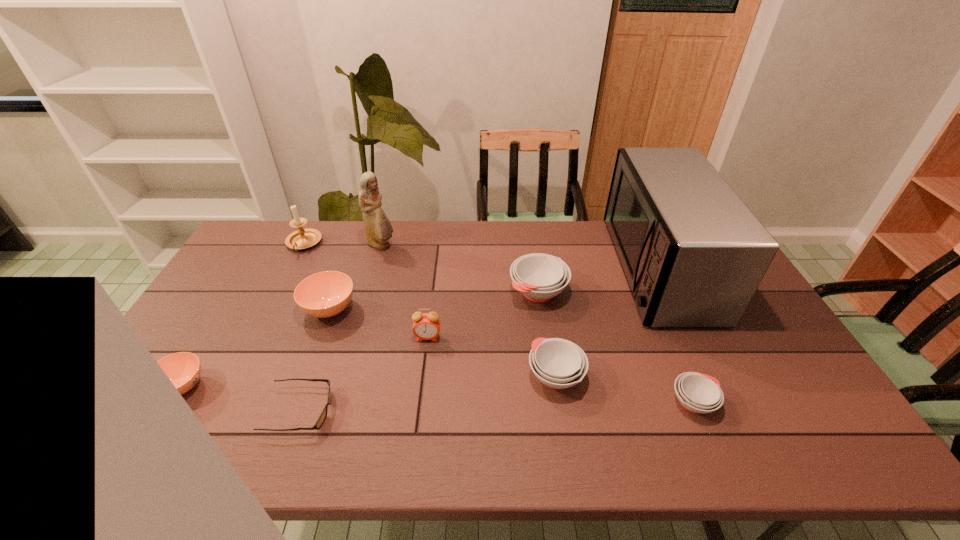
Where is `unoccupied position between the figurine and the biggest white soup bowl`? This screenshot has width=960, height=540. unoccupied position between the figurine and the biggest white soup bowl is located at coordinates (460, 268).

Locate an element on the screen. Image resolution: width=960 pixels, height=540 pixels. empty location between the farther peach soup bowl and the figurine is located at coordinates (355, 277).

You are a GUI agent. You are given a task and a screenshot of the screen. Output one action in this format:
    pyautogui.click(x=<x>, y=<y>)
    Task: Click on the free area in between the second biggest white soup bowl and the farther peach soup bowl
    
    Given the screenshot: What is the action you would take?
    pyautogui.click(x=443, y=342)

At what (x,y) coordinates should I click in order to perform the action: click on free area in between the microwave_oven and the second biggest white soup bowl. Please return your answer as a coordinate pair (x, y). Image resolution: width=960 pixels, height=540 pixels. Looking at the image, I should click on (607, 322).

This screenshot has height=540, width=960. I want to click on unoccupied area between the sunglasses and the grey microwave_oven, so click(x=479, y=339).

Identify the location of free space between the smallest white soup bowl and the figurine. (538, 324).

Locate an element on the screen. This screenshot has width=960, height=540. vacant area that lies between the rightmost white soup bowl and the biggest white soup bowl is located at coordinates (616, 347).

Locate an element on the screen. The width and height of the screenshot is (960, 540). free space between the farthest white soup bowl and the figurine is located at coordinates (460, 268).

Find the location of a particular element. unoccupied area between the sunglasses and the third tallest object is located at coordinates (301, 327).

The width and height of the screenshot is (960, 540). I want to click on vacant space in between the shortest object and the second biggest white soup bowl, so click(x=428, y=393).